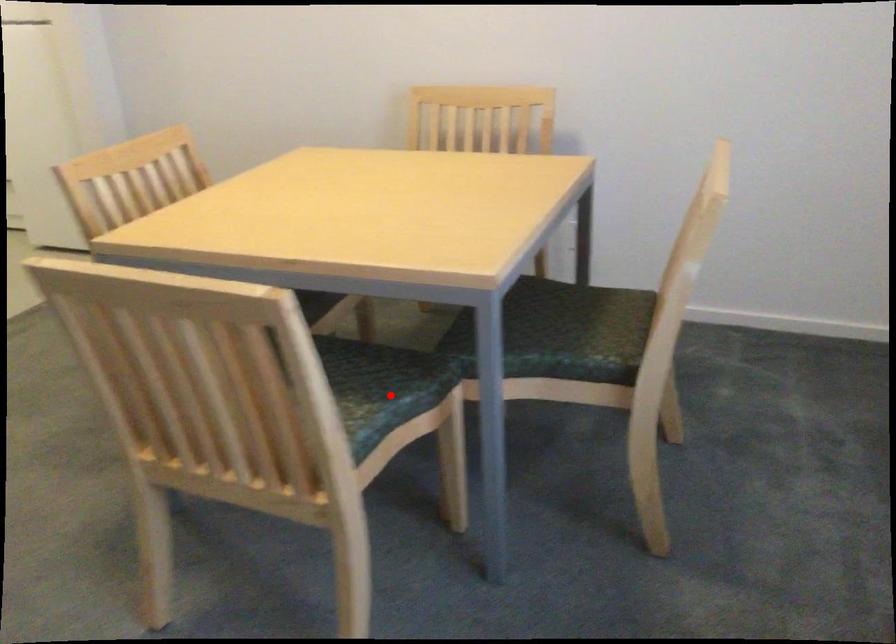
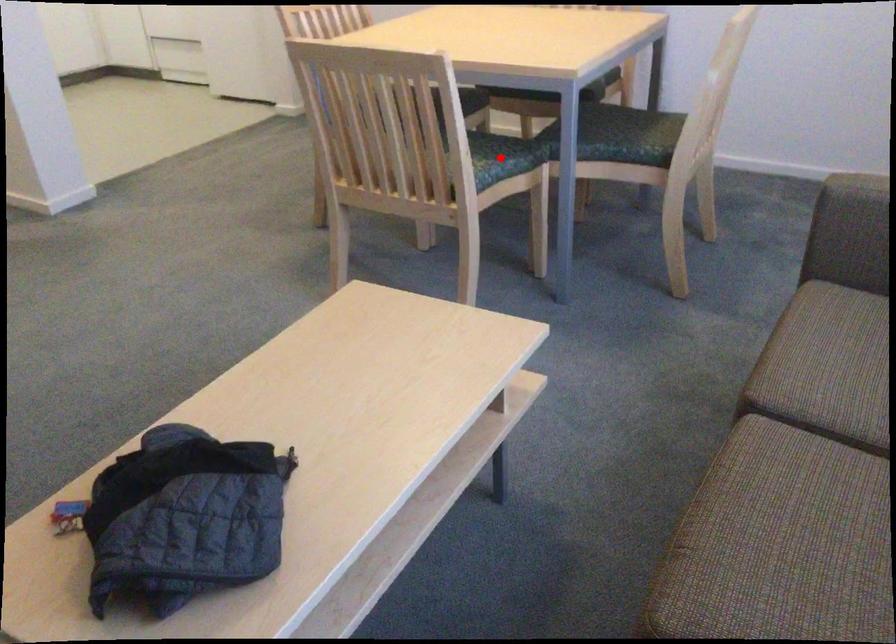
I am providing you with two images of the same scene from different viewpoints. A red point is marked on the first image and another point is marked on the second image. Do the highlighted points in image1 and image2 indicate the same real-world spot?

Yes